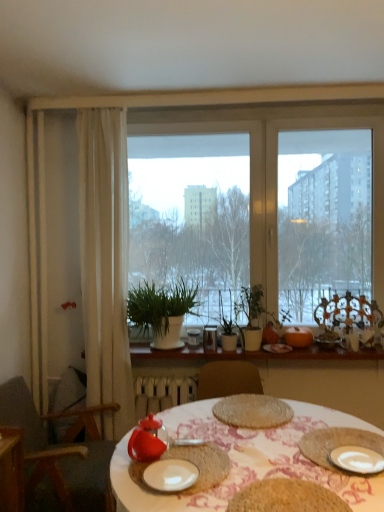
At what (x,y) coordinates should I click in order to perform the action: click on vacant area that lies between white matte plate at center, which ranks as the 2th plate in right-to-left order, and baked golden bread at center, which is the first food from back to front. Please return your answer as a coordinate pair (x, y). The image size is (384, 512). Looking at the image, I should click on (224, 443).